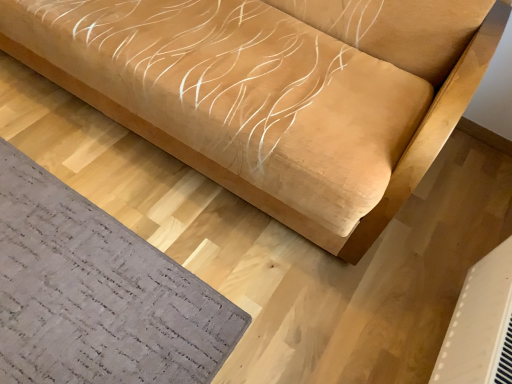
Question: Is white plastic air conditioning unit at lower right thinner than gray textured mat at lower left?

Choices:
 (A) no
 (B) yes

Answer: (B)

Question: From a real-world perspective, is white plastic air conditioning unit at lower right beneath gray textured mat at lower left?

Choices:
 (A) yes
 (B) no

Answer: (B)

Question: Can you confirm if white plastic air conditioning unit at lower right is bigger than gray textured mat at lower left?

Choices:
 (A) no
 (B) yes

Answer: (B)

Question: From the image's perspective, is white plastic air conditioning unit at lower right under gray textured mat at lower left?

Choices:
 (A) no
 (B) yes

Answer: (B)

Question: Is white plastic air conditioning unit at lower right next to gray textured mat at lower left and touching it?

Choices:
 (A) no
 (B) yes

Answer: (A)

Question: Looking at their shapes, would you say suede-like beige sofa at upper center is wider or thinner than white plastic air conditioning unit at lower right?

Choices:
 (A) thin
 (B) wide

Answer: (B)

Question: Visually, is suede-like beige sofa at upper center positioned to the left or to the right of white plastic air conditioning unit at lower right?

Choices:
 (A) left
 (B) right

Answer: (A)

Question: Is suede-like beige sofa at upper center taller or shorter than white plastic air conditioning unit at lower right?

Choices:
 (A) short
 (B) tall

Answer: (B)

Question: Is suede-like beige sofa at upper center in front of or behind white plastic air conditioning unit at lower right in the image?

Choices:
 (A) front
 (B) behind

Answer: (A)

Question: Considering the positions of gray textured mat at lower left and white plastic air conditioning unit at lower right in the image, is gray textured mat at lower left bigger or smaller than white plastic air conditioning unit at lower right?

Choices:
 (A) small
 (B) big

Answer: (A)

Question: From a real-world perspective, is gray textured mat at lower left physically located above or below white plastic air conditioning unit at lower right?

Choices:
 (A) above
 (B) below

Answer: (B)

Question: Is gray textured mat at lower left in front of or behind white plastic air conditioning unit at lower right in the image?

Choices:
 (A) behind
 (B) front

Answer: (A)

Question: From the image's perspective, relative to white plastic air conditioning unit at lower right, is gray textured mat at lower left above or below?

Choices:
 (A) below
 (B) above

Answer: (B)

Question: Considering the positions of gray textured mat at lower left and suede-like beige sofa at upper center in the image, is gray textured mat at lower left bigger or smaller than suede-like beige sofa at upper center?

Choices:
 (A) big
 (B) small

Answer: (B)

Question: Is gray textured mat at lower left in front of or behind suede-like beige sofa at upper center in the image?

Choices:
 (A) front
 (B) behind

Answer: (B)